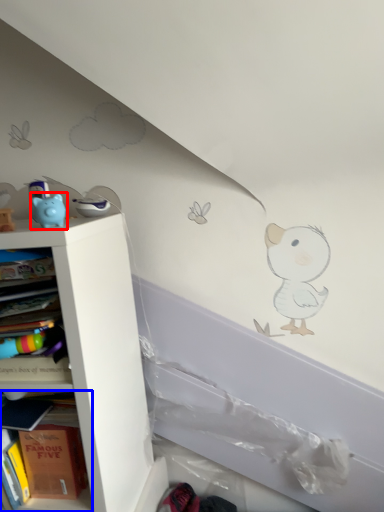
Question: Among these objects, which one is farthest to the camera, toy (highlighted by a red box) or shelf (highlighted by a blue box)?

Choices:
 (A) toy
 (B) shelf

Answer: (B)